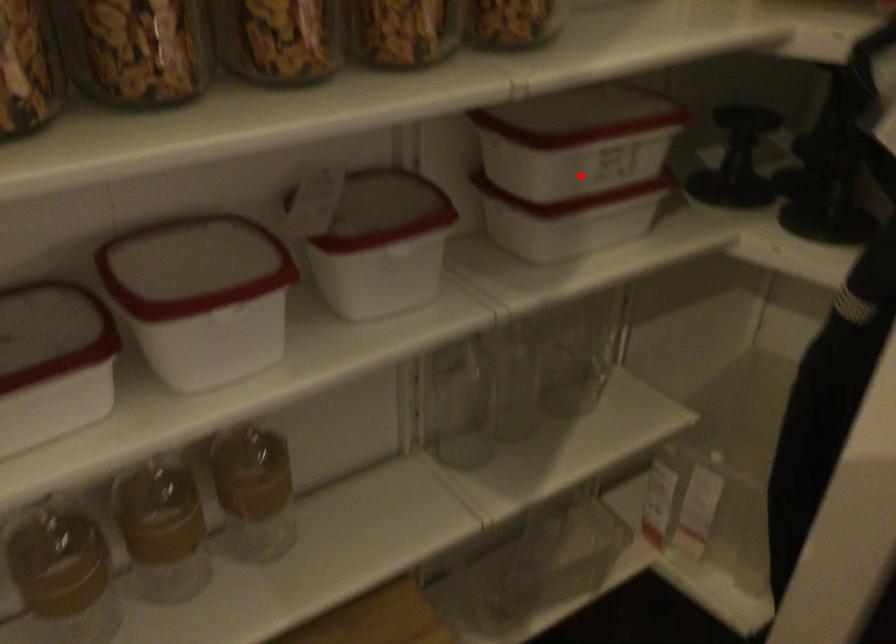
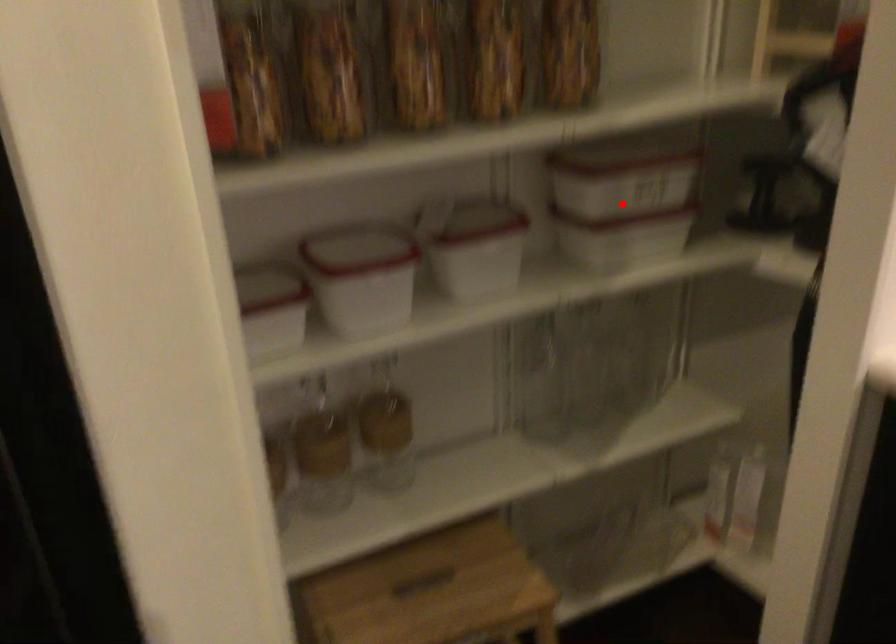
I am providing you with two images of the same scene from different viewpoints. A red point is marked on the first image and another point is marked on the second image. Does the point marked in image1 correspond to the same location as the one in image2?

Yes